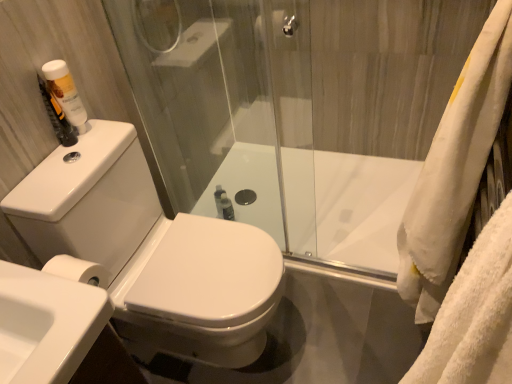
Question: Can you confirm if white fluffy bath towel at right is taller than white plastic bottle at upper left?

Choices:
 (A) yes
 (B) no

Answer: (A)

Question: From a real-world perspective, does white fluffy bath towel at right sit lower than white plastic bottle at upper left?

Choices:
 (A) yes
 (B) no

Answer: (A)

Question: Does white fluffy bath towel at right have a lesser width compared to white plastic bottle at upper left?

Choices:
 (A) yes
 (B) no

Answer: (B)

Question: Does white fluffy bath towel at right have a lesser height compared to white plastic bottle at upper left?

Choices:
 (A) yes
 (B) no

Answer: (B)

Question: Can you confirm if white fluffy bath towel at right is wider than white plastic bottle at upper left?

Choices:
 (A) yes
 (B) no

Answer: (A)

Question: Is white plastic bottle at upper left bigger or smaller than white glossy toilet at center?

Choices:
 (A) big
 (B) small

Answer: (B)

Question: Relative to white glossy toilet at center, is white plastic bottle at upper left in front or behind?

Choices:
 (A) behind
 (B) front

Answer: (A)

Question: In terms of width, does white plastic bottle at upper left look wider or thinner when compared to white glossy toilet at center?

Choices:
 (A) thin
 (B) wide

Answer: (A)

Question: Is white plastic bottle at upper left taller or shorter than white glossy toilet at center?

Choices:
 (A) tall
 (B) short

Answer: (B)

Question: Does point (375, 125) appear closer or farther from the camera than point (55, 64)?

Choices:
 (A) farther
 (B) closer

Answer: (A)

Question: In terms of height, does transparent glass shower door at upper right look taller or shorter compared to white plastic bottle at upper left?

Choices:
 (A) short
 (B) tall

Answer: (B)

Question: In terms of size, does transparent glass shower door at upper right appear bigger or smaller than white plastic bottle at upper left?

Choices:
 (A) big
 (B) small

Answer: (A)

Question: From a real-world perspective, is transparent glass shower door at upper right positioned above or below white plastic bottle at upper left?

Choices:
 (A) above
 (B) below

Answer: (B)

Question: From the image's perspective, relative to transparent glass shower door at upper right, is white glossy toilet at center above or below?

Choices:
 (A) above
 (B) below

Answer: (B)

Question: Is white glossy toilet at center spatially inside transparent glass shower door at upper right, or outside of it?

Choices:
 (A) inside
 (B) outside

Answer: (B)